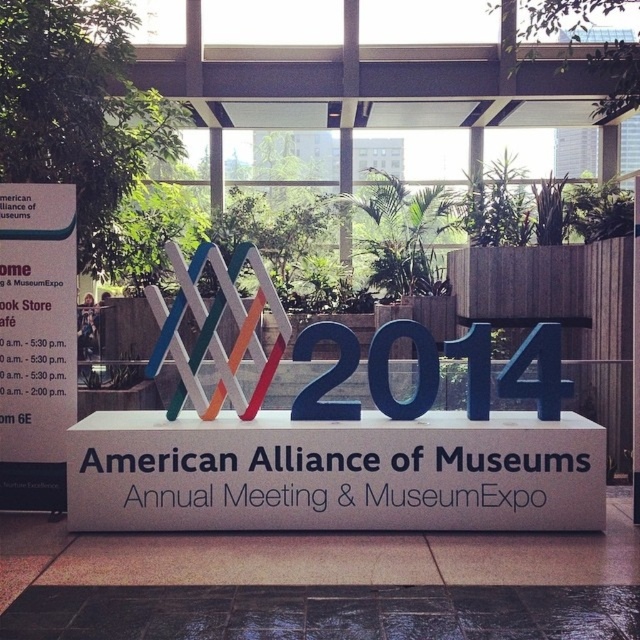
Can you confirm if white matte sign at center is positioned below black tile floor at lower center?

No, white matte sign at center is not below black tile floor at lower center.

Is white matte sign at center further to the viewer compared to black tile floor at lower center?

Yes.

Who is more forward, (378, 477) or (365, 634)?

Positioned in front is point (365, 634).

At what (x,y) coordinates should I click in order to perform the action: click on white matte sign at center. Please return your answer as a coordinate pair (x, y). This screenshot has height=640, width=640. Looking at the image, I should click on (333, 474).